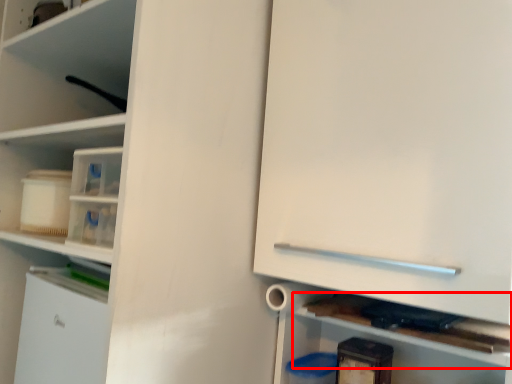
Question: From the image's perspective, where is cabinet (annotated by the red box) located in relation to cabinetry in the image?

Choices:
 (A) above
 (B) below

Answer: (B)